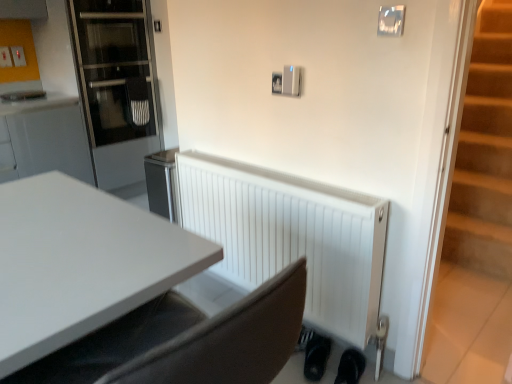
The image size is (512, 384). What do you see at coordinates (290, 236) in the screenshot?
I see `white matte radiator at lower center` at bounding box center [290, 236].

Image resolution: width=512 pixels, height=384 pixels. What are the coordinates of `transparent glass door at left` in the screenshot? It's located at (117, 86).

What do you see at coordinates (80, 263) in the screenshot? The height and width of the screenshot is (384, 512). I see `white glossy desk at center` at bounding box center [80, 263].

The width and height of the screenshot is (512, 384). What do you see at coordinates (350, 367) in the screenshot?
I see `black rubber shoe at lower right, which appears as the second shoe when viewed from the left` at bounding box center [350, 367].

This screenshot has height=384, width=512. Find the location of `white matte radiator at lower center`. white matte radiator at lower center is located at coordinates (290, 236).

Locate an element on the screen. The width and height of the screenshot is (512, 384). radiator located above the black matte shoe at lower right, positioned as the 1th shoe in left-to-right order (from the image's perspective) is located at coordinates (290, 236).

Which is closer, (254, 220) or (318, 337)?

Point (318, 337)

Is white matte radiator at lower center inside or outside of black matte shoe at lower right, the second shoe positioned from the right?

The correct answer is: outside.

Is white matte radiator at lower center not near black matte shoe at lower right, the second shoe positioned from the right?

No, there isn't a large distance between white matte radiator at lower center and black matte shoe at lower right, the second shoe positioned from the right.

Is black matte shoe at lower right, the second shoe positioned from the right, wider than white matte radiator at lower center?

Correct, the width of black matte shoe at lower right, the second shoe positioned from the right, exceeds that of white matte radiator at lower center.

From the image's perspective, relative to white matte radiator at lower center, is black matte shoe at lower right, the second shoe positioned from the right, above or below?

Based on their image positions, black matte shoe at lower right, the second shoe positioned from the right, is located beneath white matte radiator at lower center.

Is black matte shoe at lower right, the second shoe positioned from the right, beside white matte radiator at lower center?

black matte shoe at lower right, the second shoe positioned from the right, and white matte radiator at lower center are clearly separated.

Is black rubber shoe at lower right, the first shoe from the right, oriented away from white matte radiator at lower center?

Yes, white matte radiator at lower center is at the back of black rubber shoe at lower right, the first shoe from the right.

From a real-world perspective, is black rubber shoe at lower right, which appears as the second shoe when viewed from the left, beneath white matte radiator at lower center?

Yes, from a real-world perspective, black rubber shoe at lower right, which appears as the second shoe when viewed from the left, is beneath white matte radiator at lower center.

Can you confirm if black rubber shoe at lower right, which appears as the second shoe when viewed from the left, is wider than white matte radiator at lower center?

Indeed, black rubber shoe at lower right, which appears as the second shoe when viewed from the left, has a greater width compared to white matte radiator at lower center.

Does transparent glass door at left have a smaller size compared to white glossy desk at center?

No, transparent glass door at left is not smaller than white glossy desk at center.

Is transparent glass door at left shorter than white glossy desk at center?

Incorrect, the height of transparent glass door at left does not fall short of that of white glossy desk at center.

Where is `desk that is in front of the transparent glass door at left`? Image resolution: width=512 pixels, height=384 pixels. desk that is in front of the transparent glass door at left is located at coordinates 80,263.

How distant is transparent glass door at left from white glossy desk at center?

They are 7.59 feet apart.

Is black rubber shoe at lower right, the first shoe from the right, wider or thinner than transparent glass door at left?

black rubber shoe at lower right, the first shoe from the right, is thinner than transparent glass door at left.

From the image's perspective, is black rubber shoe at lower right, which appears as the second shoe when viewed from the left, above or below transparent glass door at left?

Based on their image positions, black rubber shoe at lower right, which appears as the second shoe when viewed from the left, is located beneath transparent glass door at left.

Is point (354, 362) closer or farther from the camera than point (144, 140)?

Point (354, 362).

From a real-world perspective, who is located higher, black rubber shoe at lower right, which appears as the second shoe when viewed from the left, or transparent glass door at left?

transparent glass door at left is physically above.

Considering the sizes of objects white matte radiator at lower center and white glossy desk at center in the image provided, who is smaller, white matte radiator at lower center or white glossy desk at center?

Smaller between the two is white glossy desk at center.

Looking at this image, can you tell me how much white matte radiator at lower center and white glossy desk at center differ in facing direction?

The facing directions of white matte radiator at lower center and white glossy desk at center are 89.2 degrees apart.

From the picture: Is white glossy desk at center surrounded by white matte radiator at lower center?

Actually, white glossy desk at center is outside white matte radiator at lower center.

Is point (361, 196) closer to camera compared to point (42, 338)?

No, (361, 196) is further to viewer.

Measure the distance between white glossy desk at center and transparent glass door at left.

They are 2.31 meters apart.

Is white glossy desk at center further to the viewer compared to transparent glass door at left?

No, it is not.

From the image's perspective, is white glossy desk at center above or below transparent glass door at left?

From the image's perspective, white glossy desk at center appears below transparent glass door at left.

Image resolution: width=512 pixels, height=384 pixels. I want to click on desk lying in front of the transparent glass door at left, so 80,263.

From a real-world perspective, count 1st shoes downward from the white matte radiator at lower center and point to it. Please provide its 2D coordinates.

[(316, 357)]

There is a black matte shoe at lower right, positioned as the 1th shoe in left-to-right order. Where is `radiator above it (from a real-world perspective)`? radiator above it (from a real-world perspective) is located at coordinates (290, 236).

When comparing their distances from black matte shoe at lower right, positioned as the 1th shoe in left-to-right order, does transparent glass door at left or white glossy desk at center seem further?

The object further to black matte shoe at lower right, positioned as the 1th shoe in left-to-right order, is transparent glass door at left.

Considering their positions, is black matte shoe at lower right, positioned as the 1th shoe in left-to-right order, positioned closer to white matte radiator at lower center than white glossy desk at center?

black matte shoe at lower right, positioned as the 1th shoe in left-to-right order, is positioned closer to the anchor white matte radiator at lower center.

Based on their spatial positions, is white matte radiator at lower center or transparent glass door at left further from black rubber shoe at lower right, the first shoe from the right?

transparent glass door at left is further to black rubber shoe at lower right, the first shoe from the right.

When comparing their distances from white matte radiator at lower center, does black rubber shoe at lower right, which appears as the second shoe when viewed from the left, or transparent glass door at left seem further?

Based on the image, transparent glass door at left appears to be further to white matte radiator at lower center.

Considering their positions, is white matte radiator at lower center positioned closer to black matte shoe at lower right, positioned as the 1th shoe in left-to-right order, than black rubber shoe at lower right, the first shoe from the right?

Based on the image, black rubber shoe at lower right, the first shoe from the right, appears to be nearer to black matte shoe at lower right, positioned as the 1th shoe in left-to-right order.

Which object lies further to the anchor point white glossy desk at center, black matte shoe at lower right, positioned as the 1th shoe in left-to-right order, or black rubber shoe at lower right, which appears as the second shoe when viewed from the left?

A: black rubber shoe at lower right, which appears as the second shoe when viewed from the left, lies further to white glossy desk at center than the other object.

Considering their positions, is white glossy desk at center positioned closer to transparent glass door at left than black rubber shoe at lower right, which appears as the second shoe when viewed from the left?

white glossy desk at center.

Based on their spatial positions, is white matte radiator at lower center or white glossy desk at center further from black rubber shoe at lower right, the first shoe from the right?

white glossy desk at center.

The width and height of the screenshot is (512, 384). In order to click on shoe between white matte radiator at lower center and black rubber shoe at lower right, which appears as the second shoe when viewed from the left, in the vertical direction in this screenshot , I will do `click(316, 357)`.

Where is `radiator located between transparent glass door at left and black rubber shoe at lower right, the first shoe from the right, in the left-right direction`? radiator located between transparent glass door at left and black rubber shoe at lower right, the first shoe from the right, in the left-right direction is located at coordinates (290, 236).

At what (x,y) coordinates should I click in order to perform the action: click on shoe between transparent glass door at left and black rubber shoe at lower right, which appears as the second shoe when viewed from the left. Please return your answer as a coordinate pair (x, y). This screenshot has height=384, width=512. Looking at the image, I should click on (316, 357).

At what (x,y) coordinates should I click in order to perform the action: click on radiator located between transparent glass door at left and black matte shoe at lower right, the second shoe positioned from the right, in the left-right direction. Please return your answer as a coordinate pair (x, y). Looking at the image, I should click on (290, 236).